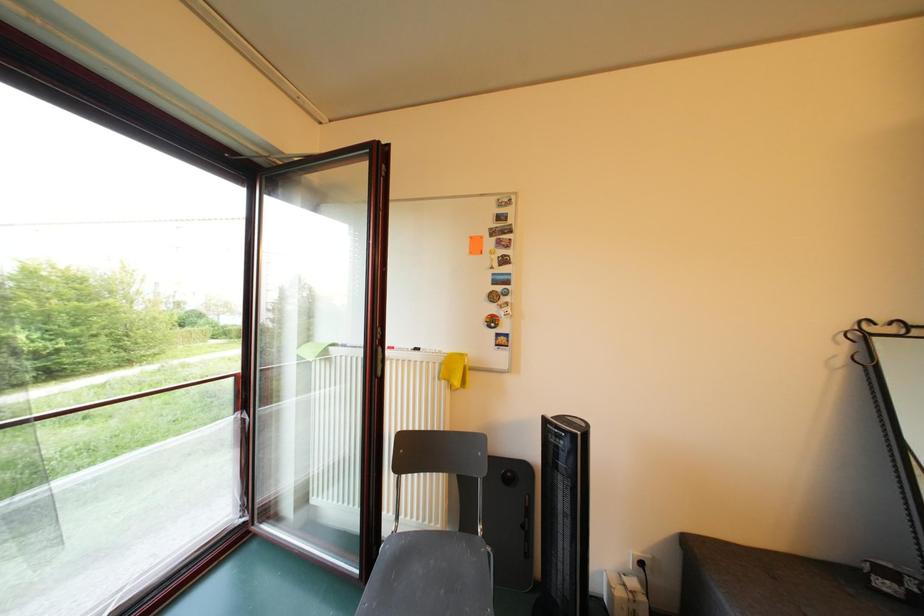
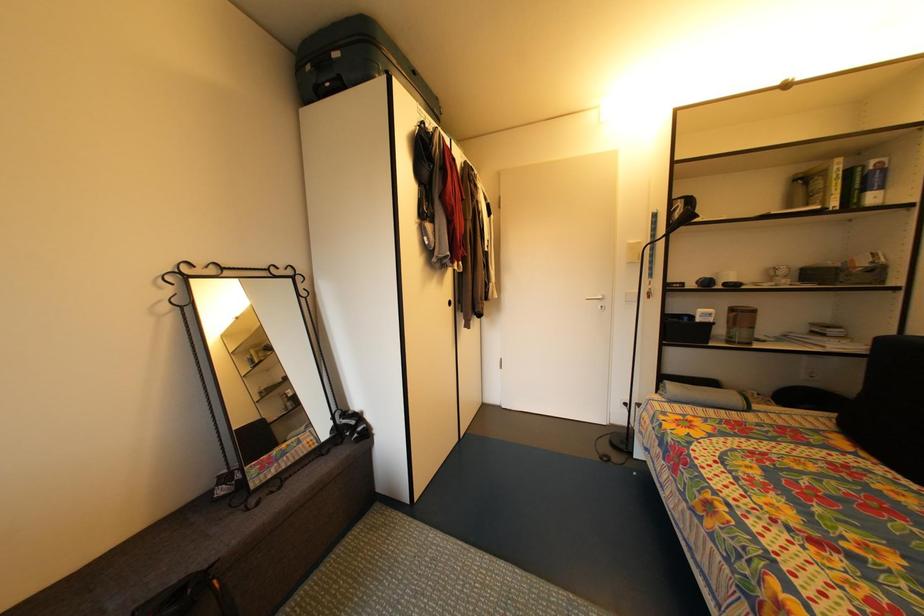
Question: The images are taken continuously from a first-person perspective. In which direction is your viewpoint rotating?

Choices:
 (A) Left
 (B) Right
 (C) Up
 (D) Down

Answer: (B)